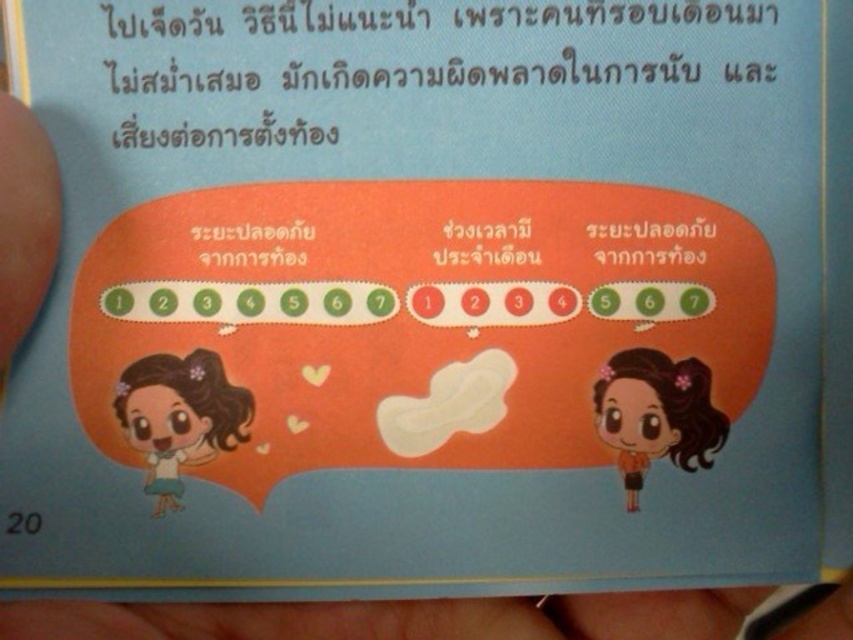
Question: In this image, where is matte brown hair at left located relative to orange matte hair at center?

Choices:
 (A) right
 (B) left

Answer: (B)

Question: Is matte brown hair at left to the right of orange matte hair at center from the viewer's perspective?

Choices:
 (A) no
 (B) yes

Answer: (A)

Question: Does matte brown hair at left come behind orange matte hair at center?

Choices:
 (A) yes
 (B) no

Answer: (B)

Question: Which of the following is the closest to the observer?

Choices:
 (A) [136, 364]
 (B) [728, 428]

Answer: (B)